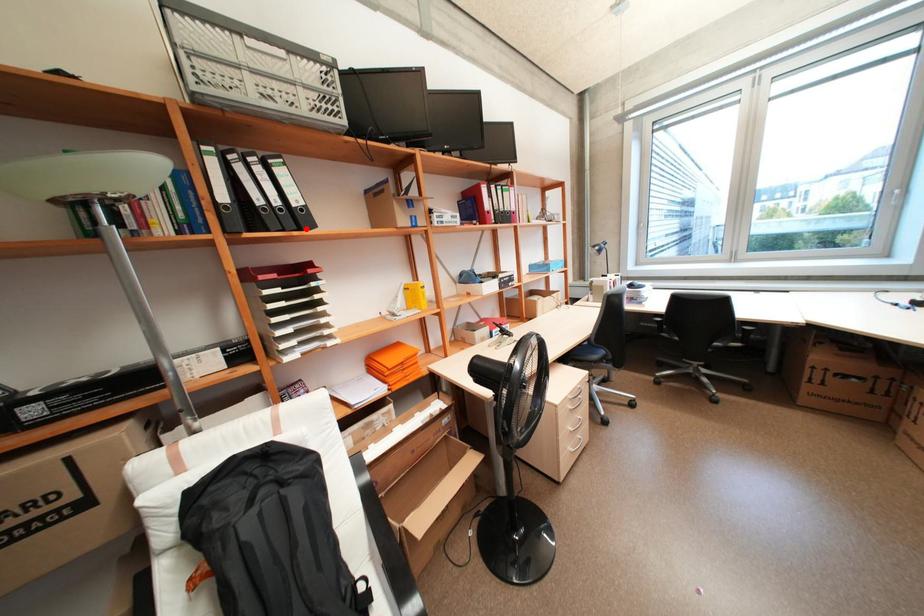
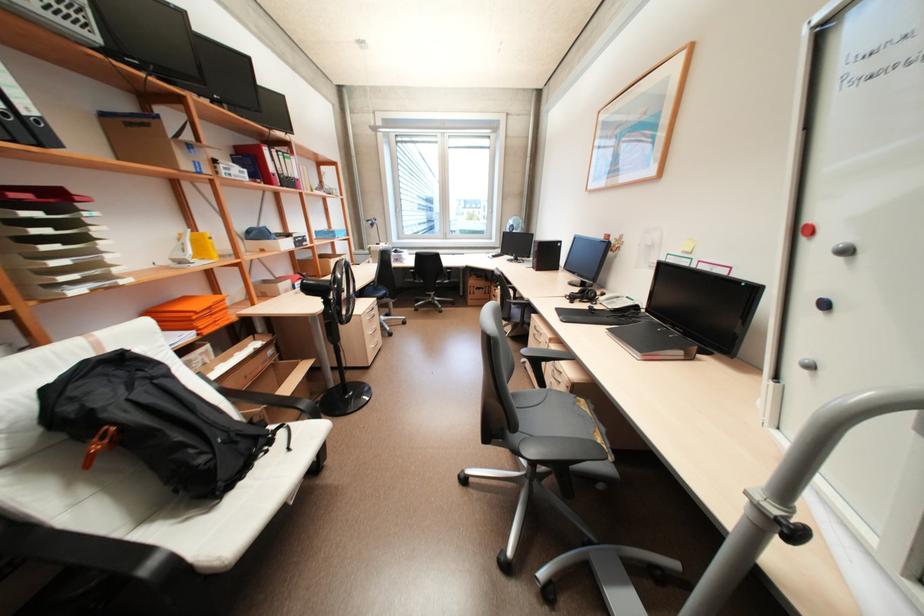
Question: I am providing you with two images of the same scene from different viewpoints. A red point is marked on the first image. Is the red point's position out of view in image 2?

Choices:
 (A) Yes
 (B) No

Answer: (B)